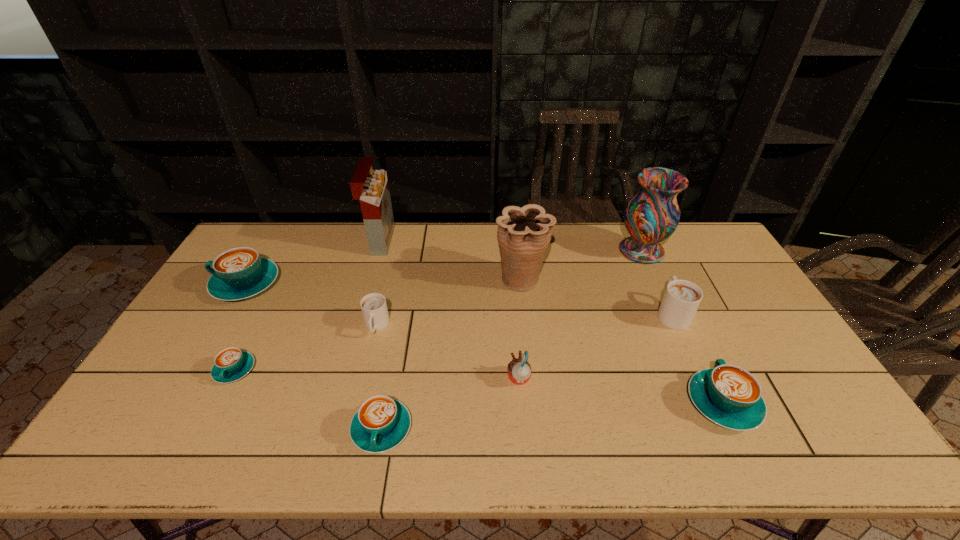
I want to click on free region that satisfies the following two spatial constraints: 1. with the handle on the right side of the farthest turquoise cappuccino; 2. with the handle on the right side of the third smallest turquoise cappuccino, so click(x=175, y=403).